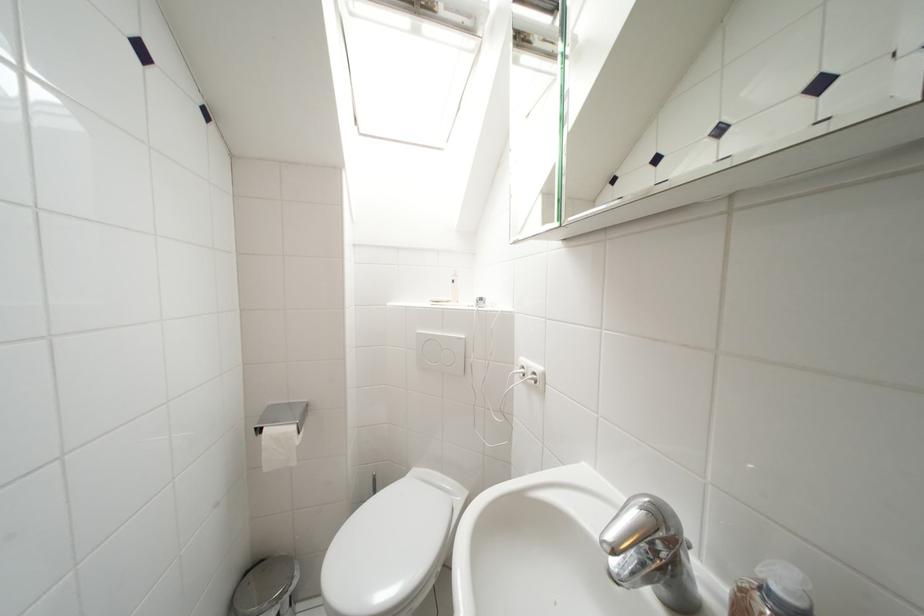
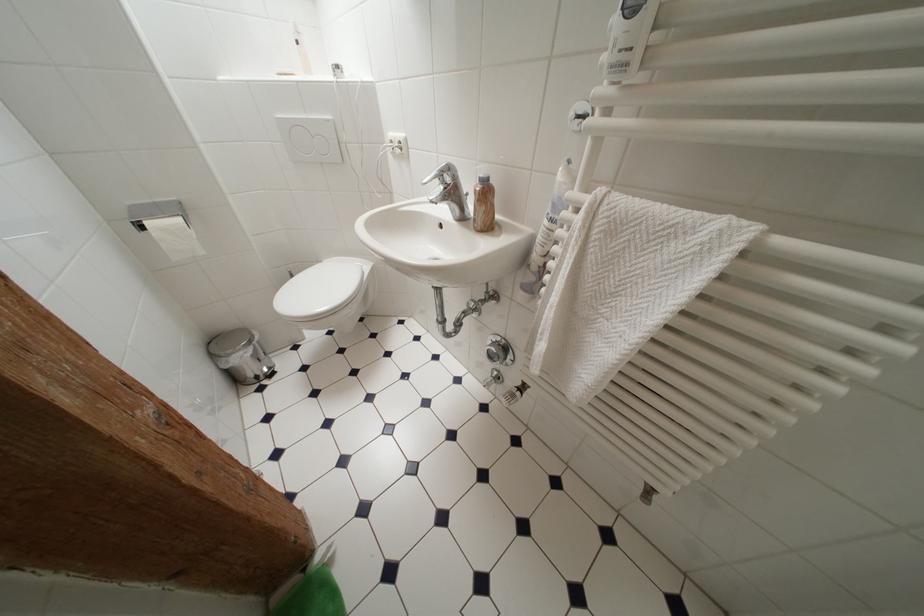
The point at (415, 476) is marked in the first image. Where is the corresponding point in the second image?

(325, 265)